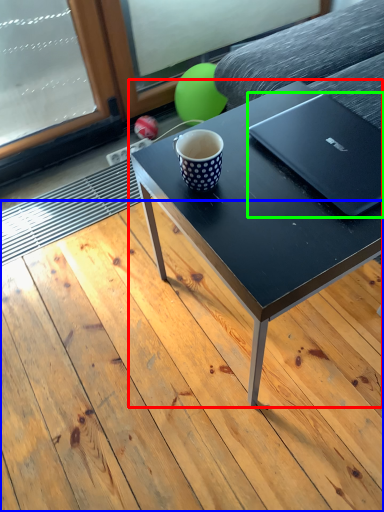
Question: Estimate the real-world distances between objects in this image. Which object is closer to coffee table (highlighted by a red box), plank (highlighted by a blue box) or laptop (highlighted by a green box)?

Choices:
 (A) plank
 (B) laptop

Answer: (B)